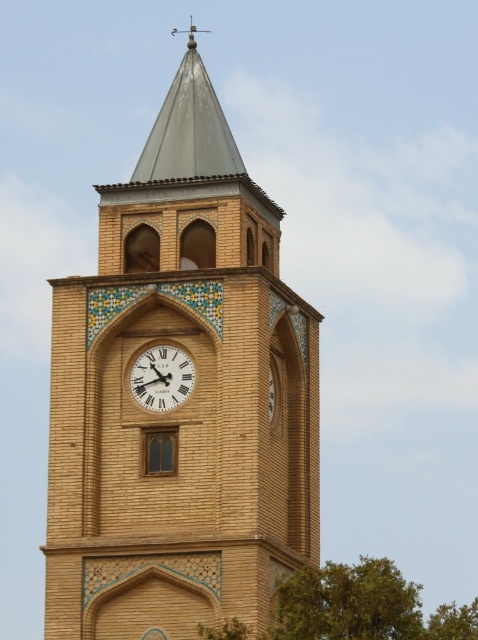
You are standing in a park and see the brown brick clock tower at center and the green leafy tree at lower right. Which object is closer to you?

The brown brick clock tower at center is closer to you because it is further to the viewer than the green leafy tree at lower right.

You are standing in front of the brown brick clock tower at center and the white wooden clock at center. Which object is taller?

The brown brick clock tower at center is much taller than the white wooden clock at center.

You are standing at the base of the white wooden clock at center and want to walk to the green leafy tree at lower right. The path is straight and clear. If your walking speed is 1.5 meters per second, how many seconds will it take you to reach the tree?

The distance between the green leafy tree at lower right and the white wooden clock at center is 12.16 meters. At a speed of 1.5 meters per second, the time required is 12.16 divided by 1.5, which equals approximately 8.11 seconds. So, it will take about 8.11 seconds to reach the tree.